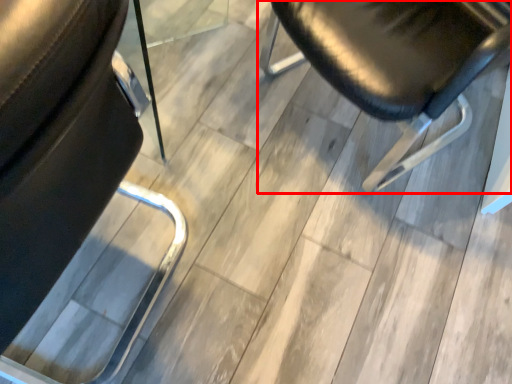
Question: From the image's perspective, what is the correct spatial positioning of chair (annotated by the red box) in reference to chair?

Choices:
 (A) below
 (B) above

Answer: (B)